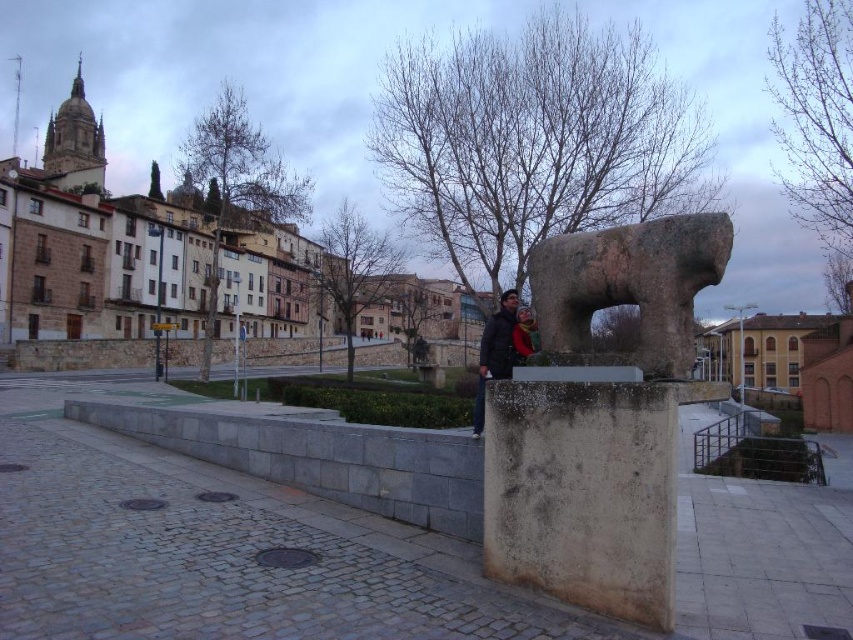
You are standing at the point marked by the coordinates point [347,552] in the image. What object are you standing on?

You are standing on the smooth concrete block at center, which is represented by the coordinates point [347,552].

You are standing at the entrance of the walkway and want to find the gray stone sculpture at center. According to the coordinates provided, in which direction should you walk to reach it?

The gray stone sculpture at center is located at coordinates point (x=601, y=419), so you should walk towards the center of the image to reach it.

You are standing at the entrance of the walkway and see the smooth concrete block at center. Based on its position, can you estimate whether it is closer to the front or the back of the walkway?

The smooth concrete block at center is located at point 0.863 on the x and 0.409 on the y axis. Since the x coordinate is closer to 1, it is positioned further to the right, but since the question is about front or back, the y coordinate of 0.409 suggests it is closer to the front of the walkway.